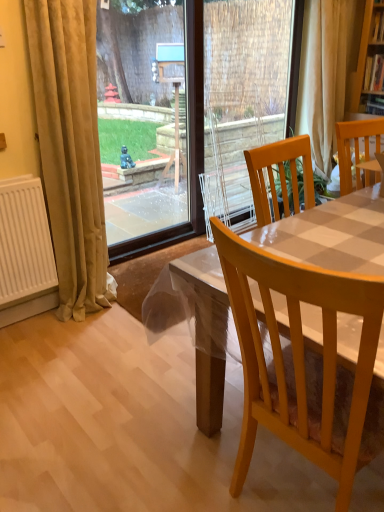
This screenshot has height=512, width=384. In order to click on wooden chair at right, arranged as the second chair when viewed from the front in this screenshot , I will do `click(355, 145)`.

Locate an element on the screen. Image resolution: width=384 pixels, height=512 pixels. beige fabric curtain at upper right, marked as the 1th curtain in a back-to-front arrangement is located at coordinates (326, 72).

How much space does light brown wooden chair at center, the second chair when ordered from top to bottom, occupy vertically?

The height of light brown wooden chair at center, the second chair when ordered from top to bottom, is 1.01 meters.

This screenshot has width=384, height=512. What are the coordinates of `clear plastic screen door at center` in the screenshot? It's located at (245, 96).

What is the approximate width of transparent glass door at upper left?

It is 10.45 centimeters.

The height and width of the screenshot is (512, 384). What do you see at coordinates (142, 51) in the screenshot? I see `transparent glass door at upper left` at bounding box center [142, 51].

Identify the location of wooden chair at right, the second chair in the left-to-right sequence. (355, 145).

Consider the image. Considering the relative sizes of wooden chair at right, arranged as the second chair when viewed from the front, and light brown wooden chair at center, which ranks as the 1th chair in front-to-back order, in the image provided, is wooden chair at right, arranged as the second chair when viewed from the front, shorter than light brown wooden chair at center, which ranks as the 1th chair in front-to-back order,?

Yes.

Is wooden chair at right, which is the first chair from right to left, at the left side of light brown wooden chair at center, the second chair when ordered from top to bottom?

In fact, wooden chair at right, which is the first chair from right to left, is to the right of light brown wooden chair at center, the second chair when ordered from top to bottom.

Can we say wooden chair at right, which is the first chair from right to left, lies outside light brown wooden chair at center, the second chair when ordered from top to bottom?

wooden chair at right, which is the first chair from right to left, is positioned outside light brown wooden chair at center, the second chair when ordered from top to bottom.

Is wooden chair at right, which is counted as the 2th chair, starting from the bottom, directly adjacent to light brown wooden chair at center, the second chair when ordered from right to left?

There is a gap between wooden chair at right, which is counted as the 2th chair, starting from the bottom, and light brown wooden chair at center, the second chair when ordered from right to left.

Consider the image. Is there a large distance between light brown wooden chair at center, arranged as the 1th chair when viewed from the left, and wooden chair at right, the first chair when ordered from top to bottom?

Yes, light brown wooden chair at center, arranged as the 1th chair when viewed from the left, and wooden chair at right, the first chair when ordered from top to bottom, are quite far apart.

Consider the image. From a real-world perspective, is light brown wooden chair at center, the second chair when ordered from top to bottom, above or below wooden chair at right, the second chair in the left-to-right sequence?

A: light brown wooden chair at center, the second chair when ordered from top to bottom, is situated lower than wooden chair at right, the second chair in the left-to-right sequence, in the real world.

Between point (366, 460) and point (368, 141), which one is positioned in front?

The point (366, 460) is more forward.

Does light brown wooden chair at center, the 2th chair when ordered from back to front, come in front of wooden chair at right, the second chair in the left-to-right sequence?

Yes, light brown wooden chair at center, the 2th chair when ordered from back to front, is in front of wooden chair at right, the second chair in the left-to-right sequence.

Does wooden chair at right, which is the first chair from right to left, turn towards beige velvet curtain at left, arranged as the second curtain when viewed from the back?

No, wooden chair at right, which is the first chair from right to left, is not facing towards beige velvet curtain at left, arranged as the second curtain when viewed from the back.

Which is more to the left, wooden chair at right, the second chair in the left-to-right sequence, or beige velvet curtain at left, the second curtain viewed from the top?

Positioned to the left is beige velvet curtain at left, the second curtain viewed from the top.

Considering the sizes of wooden chair at right, which is the first chair from right to left, and beige velvet curtain at left, which ranks as the 1th curtain in bottom-to-top order, in the image, is wooden chair at right, which is the first chair from right to left, wider or thinner than beige velvet curtain at left, which ranks as the 1th curtain in bottom-to-top order,?

wooden chair at right, which is the first chair from right to left, is wider than beige velvet curtain at left, which ranks as the 1th curtain in bottom-to-top order.

You are a GUI agent. You are given a task and a screenshot of the screen. Output one action in this format:
    pyautogui.click(x=<x>, y=<y>)
    Task: Click on the curtain in front of the wooden chair at right, the first chair when ordered from top to bottom
    
    Given the screenshot: What is the action you would take?
    pyautogui.click(x=70, y=148)

Considering the relative positions of transparent glass door at upper left and wooden chair at right, which is counted as the 2th chair, starting from the bottom, in the image provided, is transparent glass door at upper left in front of wooden chair at right, which is counted as the 2th chair, starting from the bottom,?

No, transparent glass door at upper left is behind wooden chair at right, which is counted as the 2th chair, starting from the bottom.

Between point (110, 208) and point (341, 160), which one is positioned in front?

The point (341, 160) is closer to the camera.

Is transparent glass door at upper left wider or thinner than wooden chair at right, which is counted as the 2th chair, starting from the bottom?

Considering their sizes, transparent glass door at upper left looks slimmer than wooden chair at right, which is counted as the 2th chair, starting from the bottom.

Can you tell me how much transparent glass door at upper left and wooden chair at right, arranged as the second chair when viewed from the front, differ in facing direction?

transparent glass door at upper left and wooden chair at right, arranged as the second chair when viewed from the front, are facing 88.7 degrees away from each other.

From the image's perspective, is beige velvet curtain at left, marked as the first curtain in a left-to-right arrangement, on top of transparent glass door at upper left?

Incorrect, from the image's perspective, beige velvet curtain at left, marked as the first curtain in a left-to-right arrangement, is lower than transparent glass door at upper left.

Is beige velvet curtain at left, marked as the first curtain in a left-to-right arrangement, positioned in front of transparent glass door at upper left?

That is True.

Where is `curtain that is below the transparent glass door at upper left (from the image's perspective)`? This screenshot has height=512, width=384. curtain that is below the transparent glass door at upper left (from the image's perspective) is located at coordinates (70, 148).

Is beige velvet curtain at left, the second curtain viewed from the top, facing towards transparent glass door at upper left?

No, beige velvet curtain at left, the second curtain viewed from the top, is not aimed at transparent glass door at upper left.

What are the coordinates of `screen door that is on the left side of beige fabric curtain at upper right, positioned as the 2th curtain in left-to-right order` in the screenshot? It's located at (245, 96).

From a real-world perspective, is beige fabric curtain at upper right, marked as the 1th curtain in a back-to-front arrangement, physically above clear plastic screen door at center?

Correct, in the physical world, beige fabric curtain at upper right, marked as the 1th curtain in a back-to-front arrangement, is higher than clear plastic screen door at center.

Can you confirm if beige fabric curtain at upper right, positioned as the 2th curtain in left-to-right order, is shorter than clear plastic screen door at center?

Indeed, beige fabric curtain at upper right, positioned as the 2th curtain in left-to-right order, has a lesser height compared to clear plastic screen door at center.

Is light brown wooden chair at center, marked as the first chair in a bottom-to-top arrangement, oriented away from clear plastic screen door at center?

light brown wooden chair at center, marked as the first chair in a bottom-to-top arrangement, is not turned away from clear plastic screen door at center.

Consider the image. From the image's perspective, which is below, light brown wooden chair at center, the second chair when ordered from right to left, or clear plastic screen door at center?

light brown wooden chair at center, the second chair when ordered from right to left.

Consider the image. Is light brown wooden chair at center, the 2th chair when ordered from back to front, not near clear plastic screen door at center?

Yes.

You are a GUI agent. You are given a task and a screenshot of the screen. Output one action in this format:
    pyautogui.click(x=<x>, y=<y>)
    Task: Click on the chair behind the light brown wooden chair at center, the 2th chair when ordered from back to front
    This screenshot has height=512, width=384.
    Given the screenshot: What is the action you would take?
    pyautogui.click(x=355, y=145)

The width and height of the screenshot is (384, 512). I want to click on chair located above the light brown wooden chair at center, the 2th chair when ordered from back to front (from a real-world perspective), so click(355, 145).

From the image, which object appears to be farther from transparent glass door at upper left, beige velvet curtain at left, arranged as the second curtain when viewed from the back, or wooden chair at right, the first chair when ordered from top to bottom?

wooden chair at right, the first chair when ordered from top to bottom.

Which object lies further to the anchor point light brown wooden chair at center, marked as the first chair in a bottom-to-top arrangement, beige velvet curtain at left, the second curtain viewed from the top, or beige fabric curtain at upper right, the first curtain when ordered from top to bottom?

beige fabric curtain at upper right, the first curtain when ordered from top to bottom.

Looking at the image, which one is located closer to clear plastic screen door at center, beige fabric curtain at upper right, the first curtain when ordered from top to bottom, or light brown wooden chair at center, marked as the first chair in a bottom-to-top arrangement?

Based on the image, beige fabric curtain at upper right, the first curtain when ordered from top to bottom, appears to be nearer to clear plastic screen door at center.

Based on their spatial positions, is beige fabric curtain at upper right, positioned as the 2th curtain in left-to-right order, or transparent glass door at upper left closer to light brown wooden chair at center, the 2th chair when ordered from back to front?

Based on the image, beige fabric curtain at upper right, positioned as the 2th curtain in left-to-right order, appears to be nearer to light brown wooden chair at center, the 2th chair when ordered from back to front.

From the image, which object appears to be nearer to transparent glass door at upper left, wooden chair at right, arranged as the second chair when viewed from the front, or clear plastic screen door at center?

Based on the image, clear plastic screen door at center appears to be nearer to transparent glass door at upper left.

Considering their positions, is beige fabric curtain at upper right, marked as the first curtain in a right-to-left arrangement, positioned further to clear plastic screen door at center than beige velvet curtain at left, marked as the first curtain in a left-to-right arrangement?

Among the two, beige velvet curtain at left, marked as the first curtain in a left-to-right arrangement, is located further to clear plastic screen door at center.

Looking at the image, which one is located closer to beige velvet curtain at left, marked as the 2th curtain in a right-to-left arrangement, light brown wooden chair at center, marked as the first chair in a bottom-to-top arrangement, or transparent glass door at upper left?

light brown wooden chair at center, marked as the first chair in a bottom-to-top arrangement, is closer to beige velvet curtain at left, marked as the 2th curtain in a right-to-left arrangement.

Based on their spatial positions, is light brown wooden chair at center, marked as the first chair in a bottom-to-top arrangement, or beige velvet curtain at left, marked as the first curtain in a left-to-right arrangement, closer to wooden chair at right, which is the first chair from right to left?

The object closer to wooden chair at right, which is the first chair from right to left, is beige velvet curtain at left, marked as the first curtain in a left-to-right arrangement.

Find the location of a particular element. This screenshot has width=384, height=512. screen door situated between transparent glass door at upper left and wooden chair at right, which is the first chair from right to left, from left to right is located at coordinates (245, 96).

This screenshot has height=512, width=384. What are the coordinates of `chair located between light brown wooden chair at center, the 2th chair when ordered from back to front, and beige fabric curtain at upper right, the first curtain when ordered from top to bottom, in the depth direction` in the screenshot? It's located at (355, 145).

Locate an element on the screen. The width and height of the screenshot is (384, 512). glass door between light brown wooden chair at center, marked as the first chair in a bottom-to-top arrangement, and clear plastic screen door at center in the front-back direction is located at coordinates (142, 51).

Image resolution: width=384 pixels, height=512 pixels. I want to click on curtain between light brown wooden chair at center, the second chair when ordered from top to bottom, and transparent glass door at upper left from front to back, so (x=70, y=148).